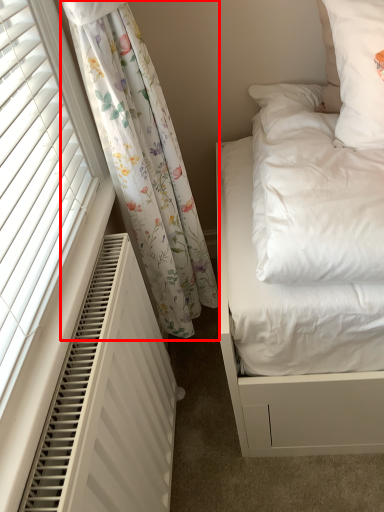
Question: From the image's perspective, considering the relative positions of curtain (annotated by the red box) and air conditioner in the image provided, where is curtain (annotated by the red box) located with respect to the staircase?

Choices:
 (A) below
 (B) above

Answer: (B)